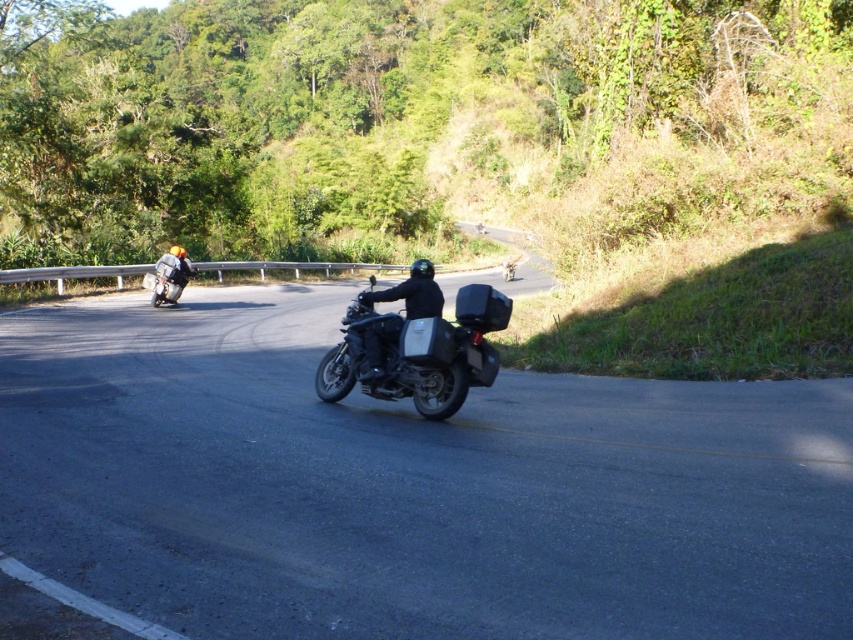
Does black asphalt road at center have a greater height compared to black matte motorcycle at center?

In fact, black asphalt road at center may be shorter than black matte motorcycle at center.

Does black asphalt road at center have a lesser height compared to black matte motorcycle at center?

Yes, black asphalt road at center is shorter than black matte motorcycle at center.

The height and width of the screenshot is (640, 853). What do you see at coordinates (408, 486) in the screenshot?
I see `black asphalt road at center` at bounding box center [408, 486].

Identify the location of black asphalt road at center. (408, 486).

Does black asphalt road at center have a lesser width compared to matte black motorcycle at center?

No, black asphalt road at center is not thinner than matte black motorcycle at center.

Is point (752, 465) positioned before point (413, 388)?

Yes, it is in front of point (413, 388).

Which is in front, point (451, 605) or point (486, 316)?

Point (451, 605)

Identify the location of black asphalt road at center. Image resolution: width=853 pixels, height=640 pixels. (408, 486).

Is point (380, 291) farther from viewer compared to point (160, 285)?

No, it is in front of (160, 285).

Does point (373, 376) lie behind point (167, 273)?

No, it is in front of (167, 273).

You are a GUI agent. You are given a task and a screenshot of the screen. Output one action in this format:
    pyautogui.click(x=<x>, y=<y>)
    Task: Click on the black matte motorcycle at center
    This screenshot has height=640, width=853.
    Given the screenshot: What is the action you would take?
    pyautogui.click(x=412, y=292)